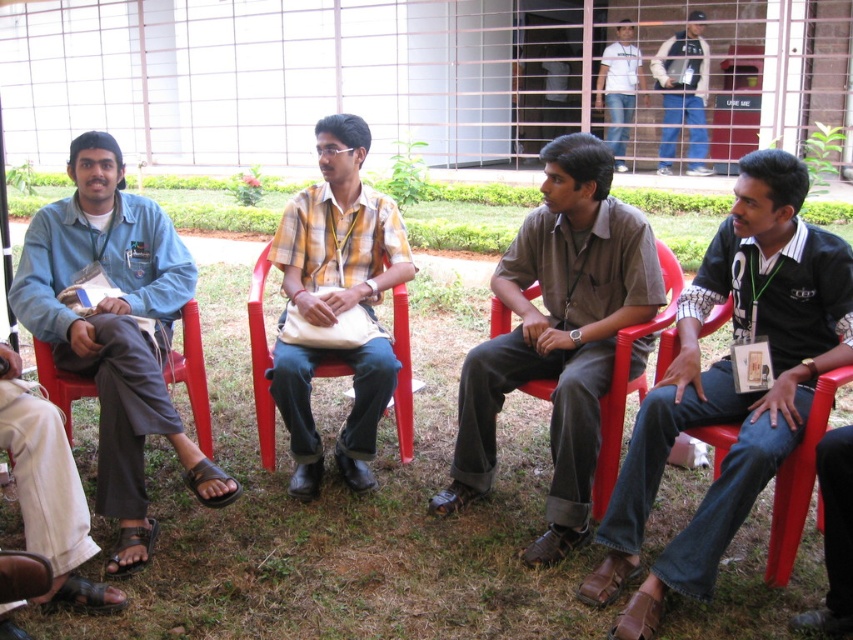
You are standing in front of the image and want to locate the denim jacket at upper right. According to the coordinates provided, where exactly should you look?

The denim jacket at upper right is located at point (683, 92).

You are standing at the center of the image and want to move to the red plastic chair at right. What direction should you face to walk directly towards it?

You should face towards the right direction since the red plastic chair at right is located at point (787, 516), which is to the right side of the image from your current position at the center.